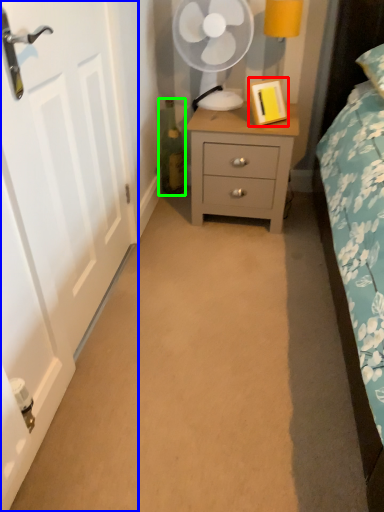
Question: Estimate the real-world distances between objects in this image. Which object is farther from picture frame (highlighted by a red box), door (highlighted by a blue box) or bottle (highlighted by a green box)?

Choices:
 (A) door
 (B) bottle

Answer: (A)